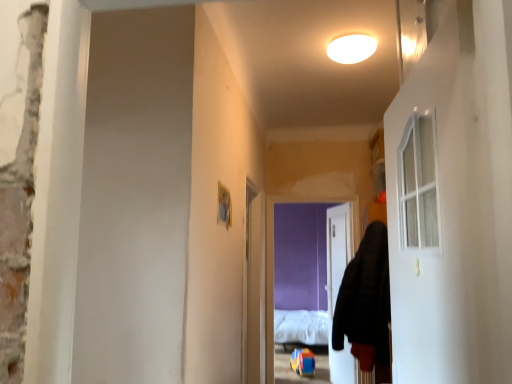
Question: Would you consider clear plastic screen door at center to be distant from white glass door at right, which appears as the second door when viewed from the right?

Choices:
 (A) no
 (B) yes

Answer: (B)

Question: Is clear plastic screen door at center looking in the opposite direction of white glass door at right, the second door when ordered from back to front?

Choices:
 (A) no
 (B) yes

Answer: (A)

Question: Considering the relative sizes of clear plastic screen door at center and white glass door at right, which appears as the second door when viewed from the right, in the image provided, is clear plastic screen door at center wider than white glass door at right, which appears as the second door when viewed from the right,?

Choices:
 (A) yes
 (B) no

Answer: (A)

Question: Considering the relative positions of clear plastic screen door at center and white glass door at right, arranged as the 1th door when viewed from the left, in the image provided, is clear plastic screen door at center to the left of white glass door at right, arranged as the 1th door when viewed from the left, from the viewer's perspective?

Choices:
 (A) no
 (B) yes

Answer: (B)

Question: From the image's perspective, is clear plastic screen door at center below white glass door at right, arranged as the 1th door when viewed from the left?

Choices:
 (A) yes
 (B) no

Answer: (A)

Question: Is clear plastic screen door at center aimed at white glass door at right, arranged as the 1th door when viewed from the left?

Choices:
 (A) no
 (B) yes

Answer: (A)

Question: Can you confirm if white glass door at right, arranged as the 1th door when viewed from the left, is taller than black fuzzy hoodie at right?

Choices:
 (A) yes
 (B) no

Answer: (B)

Question: Is white glass door at right, arranged as the 1th door when viewed from the left, to the right of black fuzzy hoodie at right from the viewer's perspective?

Choices:
 (A) yes
 (B) no

Answer: (B)

Question: Is white glass door at right, arranged as the 1th door when viewed from the left, beside black fuzzy hoodie at right?

Choices:
 (A) no
 (B) yes

Answer: (A)

Question: Is white glass door at right, arranged as the 1th door when viewed from the left, closer to camera compared to black fuzzy hoodie at right?

Choices:
 (A) no
 (B) yes

Answer: (B)

Question: From a real-world perspective, is white glass door at right, arranged as the 1th door when viewed from the left, under black fuzzy hoodie at right?

Choices:
 (A) yes
 (B) no

Answer: (B)

Question: Can you confirm if white glass door at right, arranged as the 1th door when viewed from the left, is thinner than black fuzzy hoodie at right?

Choices:
 (A) no
 (B) yes

Answer: (B)

Question: Does black fuzzy hoodie at right have a lesser width compared to white matte ceiling light at upper center?

Choices:
 (A) yes
 (B) no

Answer: (B)